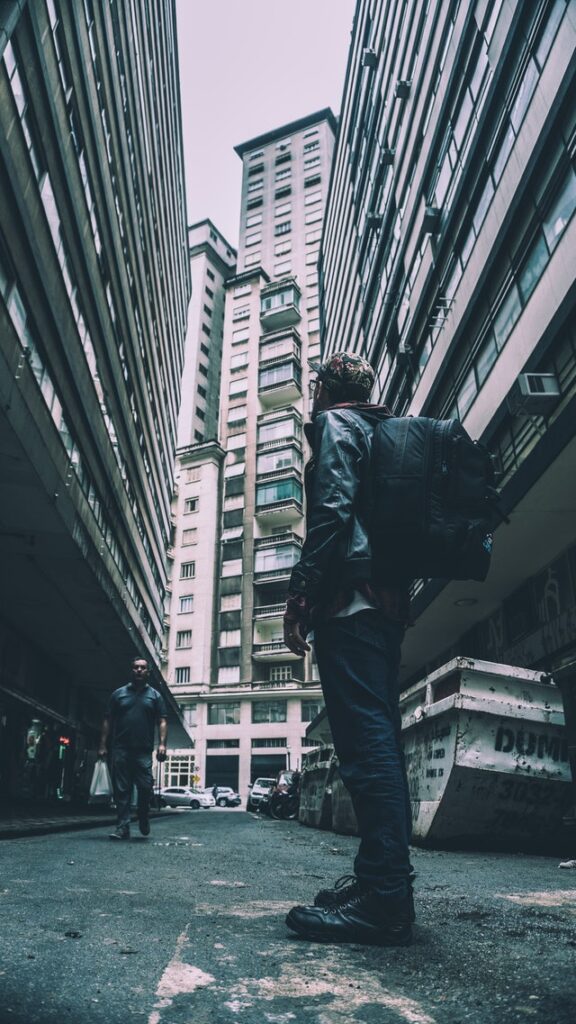
Where is `floor`? This screenshot has width=576, height=1024. floor is located at coordinates (253, 932).